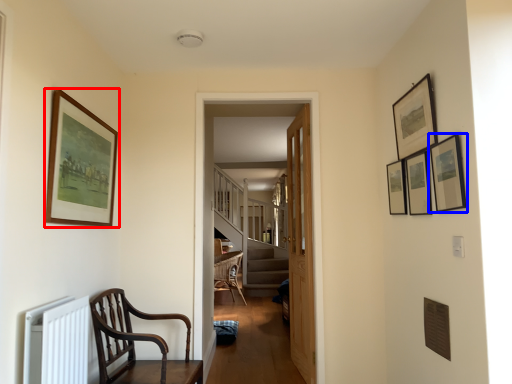
Question: Which point is further to the camera, picture frame (highlighted by a red box) or picture frame (highlighted by a blue box)?

Choices:
 (A) picture frame
 (B) picture frame

Answer: (A)